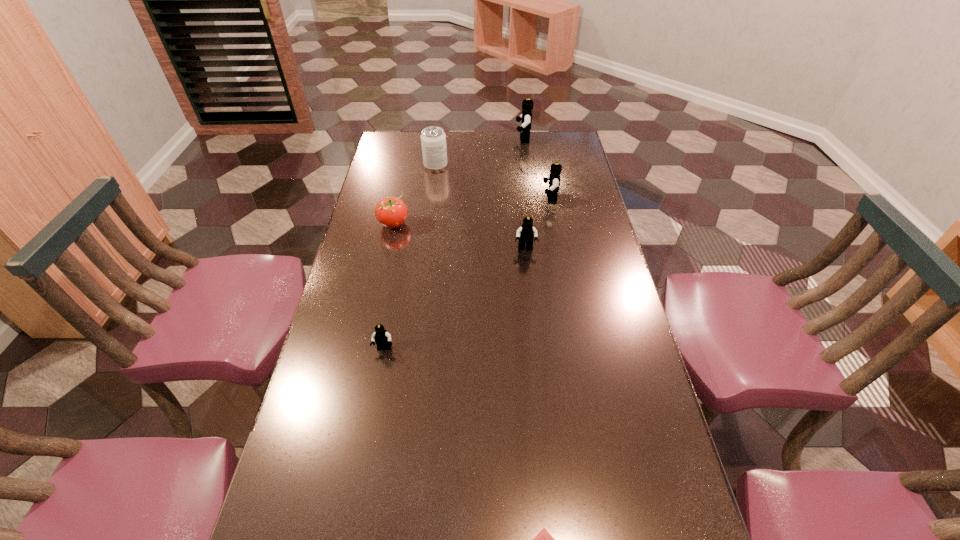
Find the location of a particular element. Image resolution: width=960 pixels, height=540 pixels. the farthest object is located at coordinates (527, 105).

Identify the location of the farthest black Lego. The image size is (960, 540). (527, 105).

At what (x,y) coordinates should I click in order to perform the action: click on the rightmost object. Please return your answer as a coordinate pair (x, y). The height and width of the screenshot is (540, 960). Looking at the image, I should click on 554,178.

Locate an element on the screen. the third farthest object is located at coordinates (554, 178).

In order to click on the second farthest object in this screenshot , I will do `click(433, 139)`.

Where is `the third farthest Lego`? the third farthest Lego is located at coordinates (525, 234).

Where is `the fifth farthest object`? This screenshot has height=540, width=960. the fifth farthest object is located at coordinates (525, 234).

Identify the location of tomato. Image resolution: width=960 pixels, height=540 pixels. click(391, 212).

Where is `red tomato`? The image size is (960, 540). red tomato is located at coordinates (391, 212).

I want to click on the leftmost Lego, so click(382, 338).